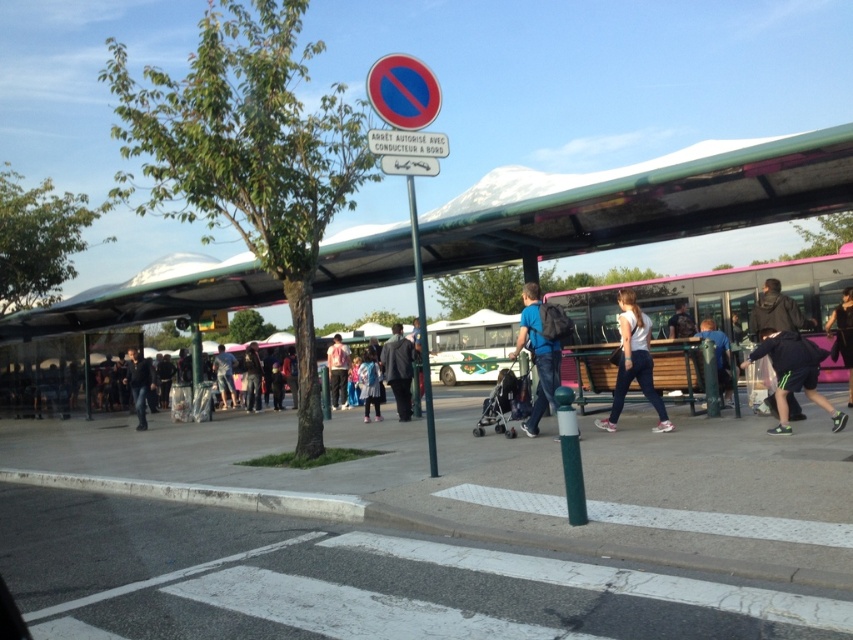
Does red plastic sign at upper center have a lesser width compared to pink fabric jacket at center?

Yes, red plastic sign at upper center is thinner than pink fabric jacket at center.

Who is shorter, red plastic sign at upper center or pink fabric jacket at center?

red plastic sign at upper center is shorter.

The width and height of the screenshot is (853, 640). Find the location of `red plastic sign at upper center`. red plastic sign at upper center is located at coordinates (403, 92).

Does dark gray suit at center have a smaller size compared to denim jacket at center?

Actually, dark gray suit at center might be larger than denim jacket at center.

What do you see at coordinates (398, 369) in the screenshot? I see `dark gray suit at center` at bounding box center [398, 369].

Which is in front, point (393, 356) or point (216, 360)?

Point (393, 356) is more forward.

At what (x,y) coordinates should I click in order to perform the action: click on dark gray suit at center. Please return your answer as a coordinate pair (x, y). This screenshot has height=640, width=853. Looking at the image, I should click on (398, 369).

The height and width of the screenshot is (640, 853). Identify the location of gray asphalt at lower center. (350, 580).

Can you confirm if gray asphalt at lower center is taller than dark blue jeans at lower left?

In fact, gray asphalt at lower center may be shorter than dark blue jeans at lower left.

Is point (80, 504) farther from camera compared to point (138, 406)?

No, (80, 504) is closer to viewer.

The image size is (853, 640). I want to click on gray asphalt at lower center, so click(350, 580).